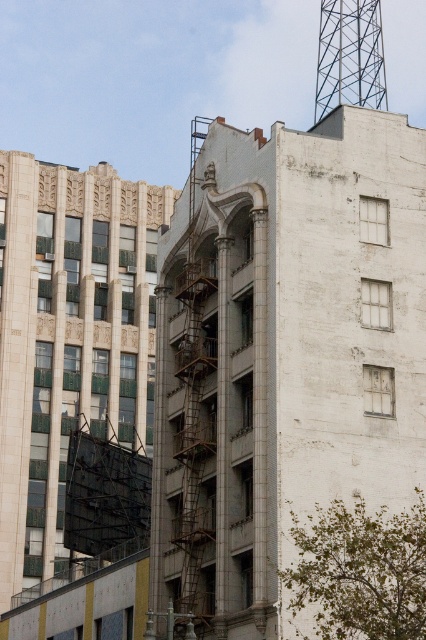
Is white concrete fire escape at upper center to the right of beige stone tower at upper left from the viewer's perspective?

Indeed, white concrete fire escape at upper center is positioned on the right side of beige stone tower at upper left.

At what (x,y) coordinates should I click in order to perform the action: click on white concrete fire escape at upper center. Please return your answer as a coordinate pair (x, y). Looking at the image, I should click on (284, 353).

Image resolution: width=426 pixels, height=640 pixels. What are the coordinates of `beige stone tower at upper left` in the screenshot? It's located at (69, 339).

Which is behind, point (98, 419) or point (334, 61)?

The point (334, 61) is behind.

The image size is (426, 640). I want to click on beige stone tower at upper left, so click(x=69, y=339).

Is point (299, 416) positioned before point (345, 92)?

Yes, point (299, 416) is closer to viewer.

Does white concrete fire escape at upper center have a larger size compared to metallic lattice tower at upper right?

Indeed, white concrete fire escape at upper center has a larger size compared to metallic lattice tower at upper right.

Which is in front, point (212, 609) or point (325, 68)?

Point (212, 609) is more forward.

At what (x,y) coordinates should I click in order to perform the action: click on white concrete fire escape at upper center. Please return your answer as a coordinate pair (x, y). Looking at the image, I should click on (284, 353).